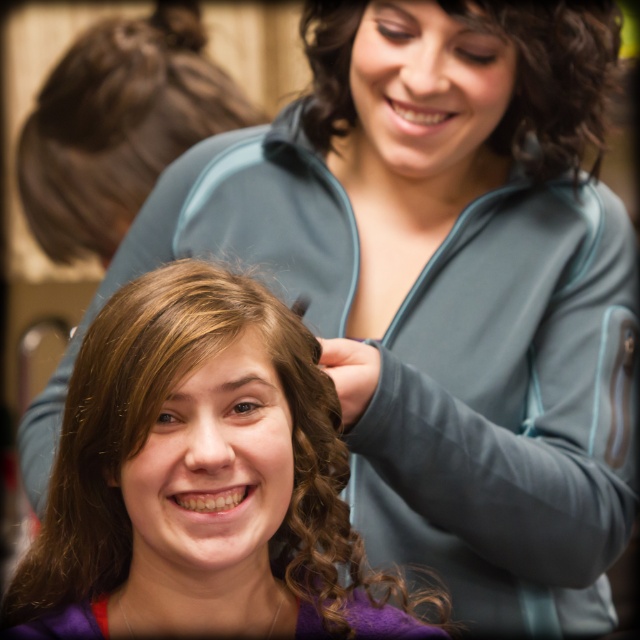
You are a photographer standing in the salon and want to take a picture of both the brown hair at upper left and the curly brown hair at upper center. Which hair is higher in the frame?

The brown hair at upper left is taller than the curly brown hair at upper center, so the brown hair at upper left is higher in the frame.

You are a stylist trying to decide which hair to style first. The smooth brown hair at center and the brown hair at upper left are both in your view. Which one is smaller in size?

The smooth brown hair at center has a smaller size compared to the brown hair at upper left, so you should style the smooth brown hair at center first.